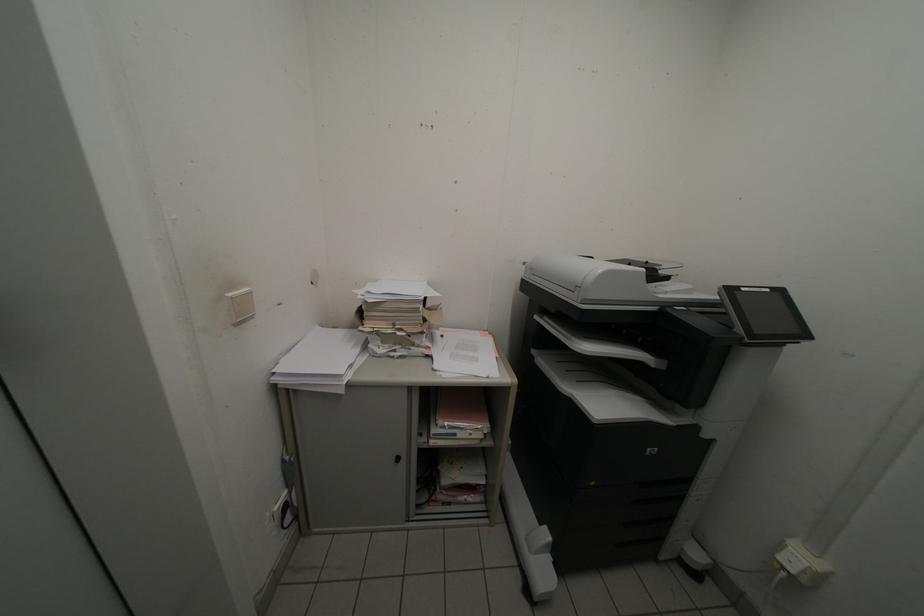
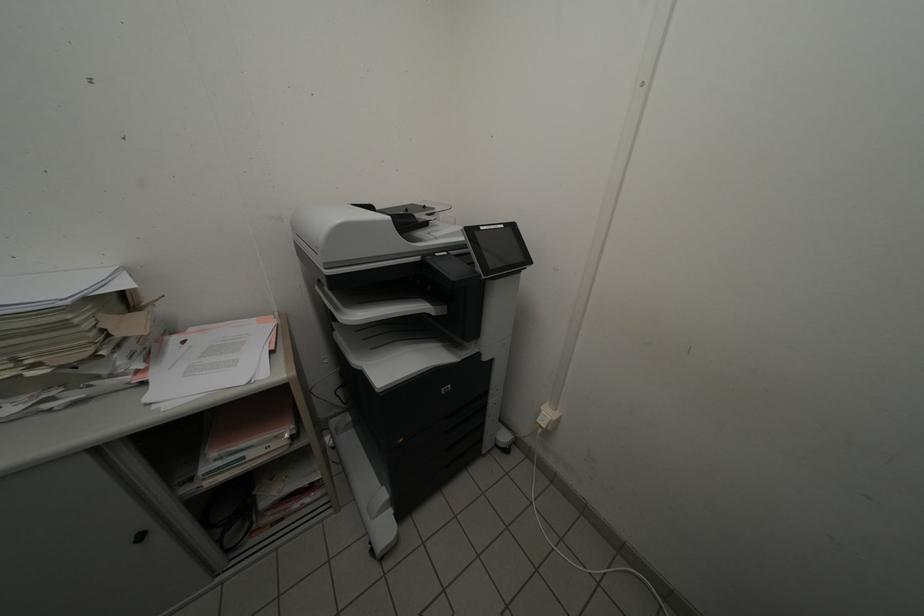
Where in the second image is the point corresponding to the point at 787,561 from the first image?

(546, 424)